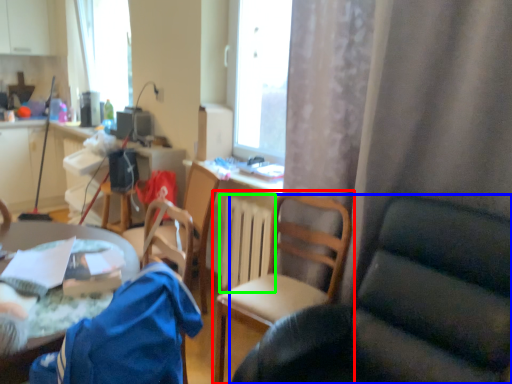
Question: Estimate the real-world distances between objects in this image. Which object is closer to chair (highlighted by a red box), chair (highlighted by a blue box) or radiator (highlighted by a green box)?

Choices:
 (A) chair
 (B) radiator

Answer: (B)